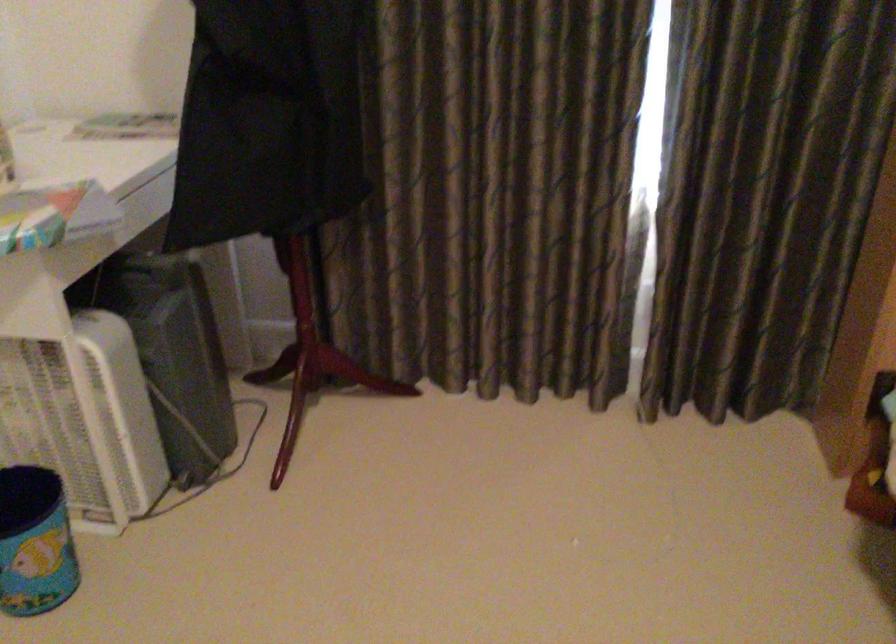
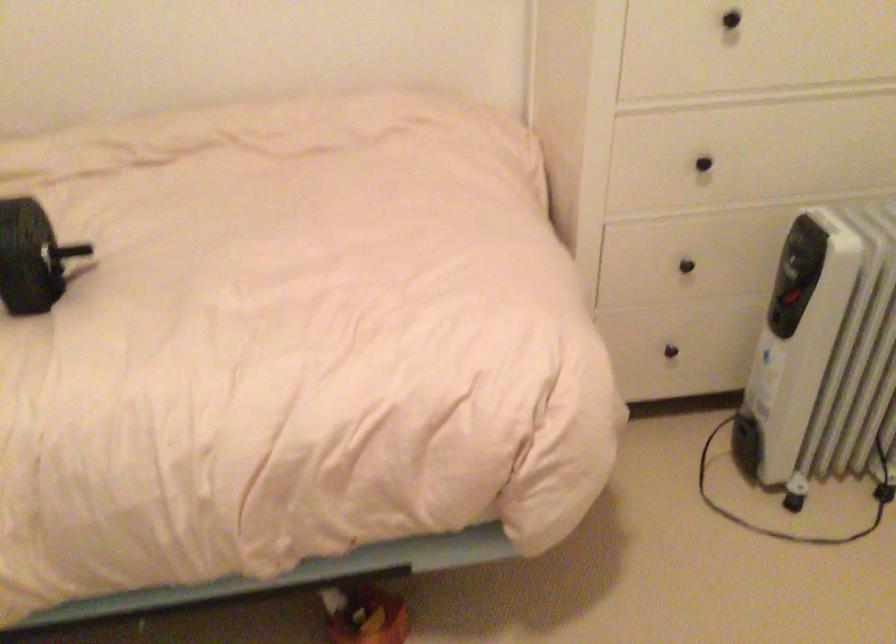
The images are taken continuously from a first-person perspective. In which direction is your viewpoint rotating?

The camera rotated toward right-down.